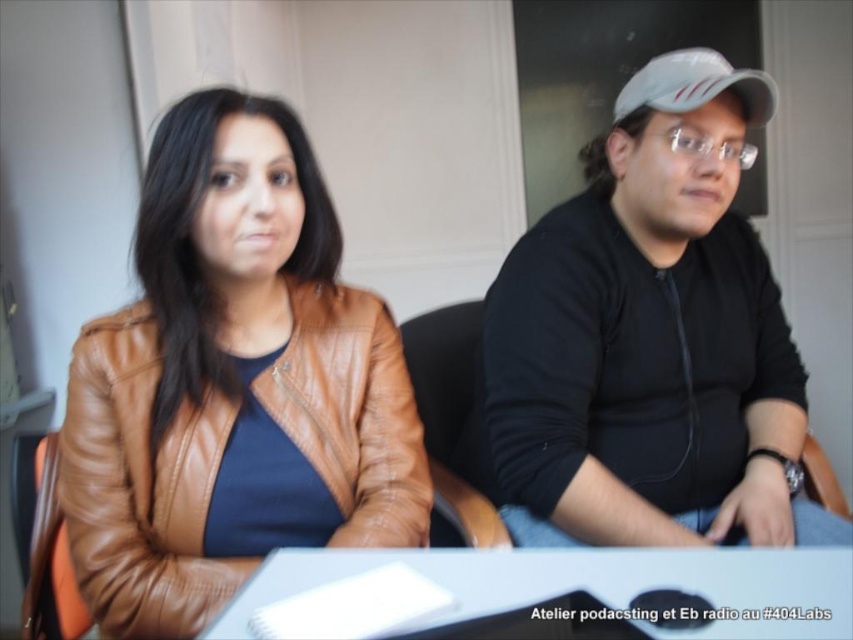
How distant is black matte shirt at right from white matte baseball cap at upper right?

black matte shirt at right and white matte baseball cap at upper right are 35.14 centimeters apart.

Is black matte shirt at right shorter than white matte baseball cap at upper right?

In fact, black matte shirt at right may be taller than white matte baseball cap at upper right.

Which is in front, point (558, 237) or point (730, 72)?

Point (730, 72)

The width and height of the screenshot is (853, 640). I want to click on black matte shirt at right, so click(653, 337).

This screenshot has height=640, width=853. What do you see at coordinates (543, 593) in the screenshot?
I see `white glossy table at center` at bounding box center [543, 593].

Looking at this image, which is more to the left, white glossy table at center or white matte baseball cap at upper right?

From the viewer's perspective, white glossy table at center appears more on the left side.

Between point (550, 611) and point (688, 93), which one is positioned in front?

Positioned in front is point (550, 611).

Where is `white glossy table at center`? Image resolution: width=853 pixels, height=640 pixels. white glossy table at center is located at coordinates (543, 593).

Between black matte shirt at right and brown leather jacket at left, which one appears on the right side from the viewer's perspective?

black matte shirt at right is more to the right.

Does point (599, 282) come closer to viewer compared to point (202, 541)?

No, (599, 282) is further to viewer.

You are a GUI agent. You are given a task and a screenshot of the screen. Output one action in this format:
    pyautogui.click(x=<x>, y=<y>)
    Task: Click on the black matte shirt at right
    Image resolution: width=853 pixels, height=640 pixels.
    Given the screenshot: What is the action you would take?
    [x=653, y=337]